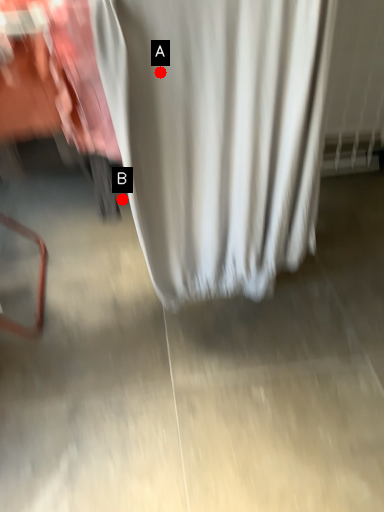
Question: Two points are circled on the image, labeled by A and B beside each circle. Which point is closer to the camera?

Choices:
 (A) A is closer
 (B) B is closer

Answer: (A)